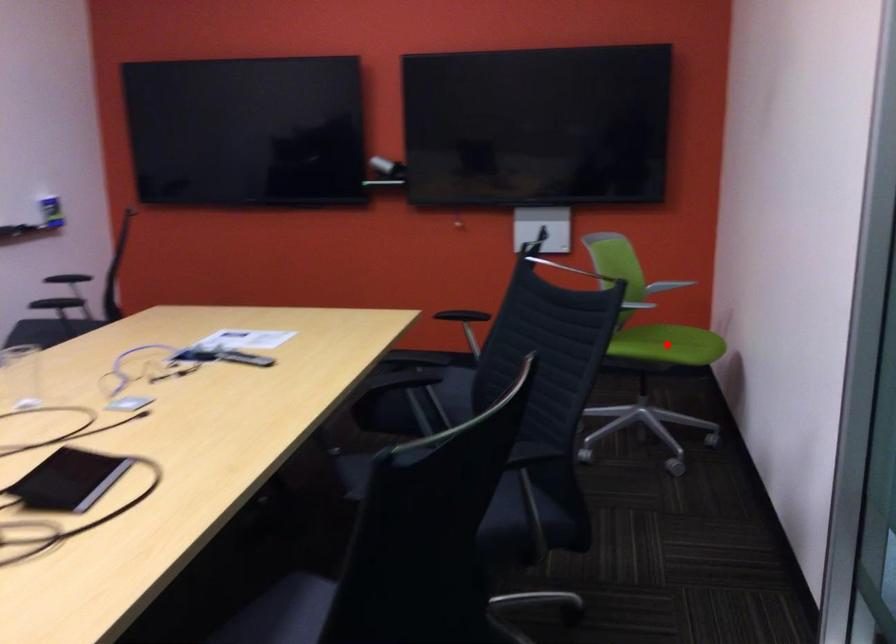
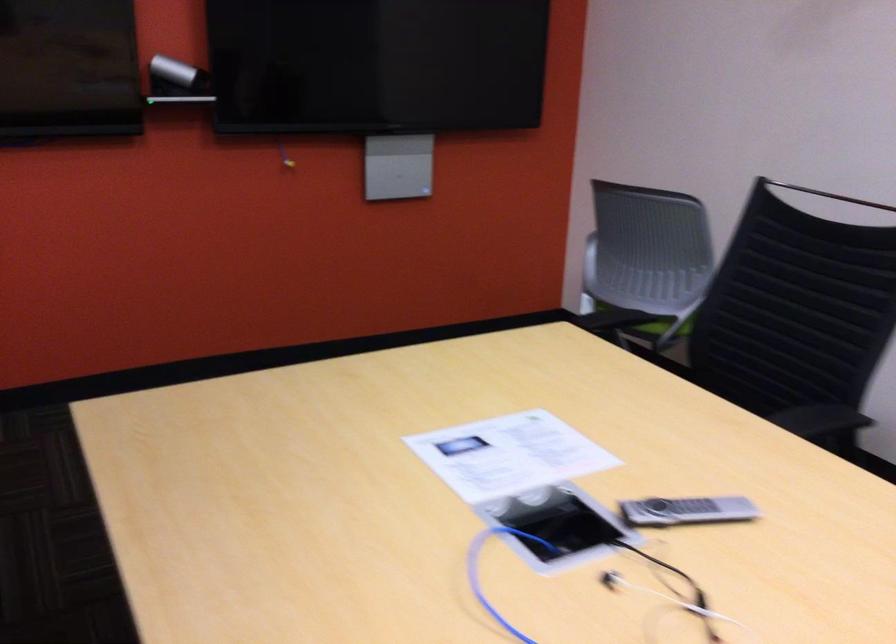
Question: I am providing you with two images of the same scene from different viewpoints. A red point is marked on the first image. Is the red point's position out of view in image 2?

Choices:
 (A) Yes
 (B) No

Answer: (A)